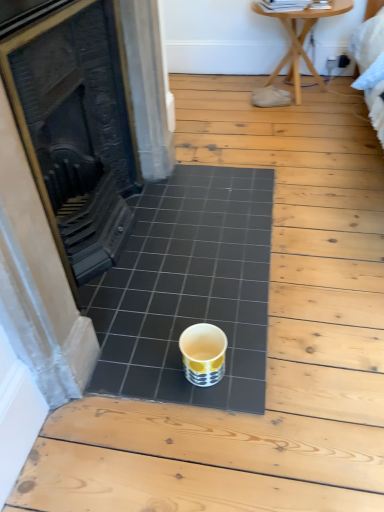
Question: Can you confirm if wooden table at upper right is wider than black ceramic tile at center?

Choices:
 (A) no
 (B) yes

Answer: (A)

Question: Is wooden table at upper right turned away from black ceramic tile at center?

Choices:
 (A) no
 (B) yes

Answer: (A)

Question: From the image's perspective, is wooden table at upper right on black ceramic tile at center?

Choices:
 (A) no
 (B) yes

Answer: (B)

Question: Are wooden table at upper right and black ceramic tile at center far apart?

Choices:
 (A) no
 (B) yes

Answer: (B)

Question: Is wooden table at upper right directly adjacent to black ceramic tile at center?

Choices:
 (A) yes
 (B) no

Answer: (B)

Question: From the image's perspective, is yellow and white ceramic cup at center located above or below wooden table at upper right?

Choices:
 (A) below
 (B) above

Answer: (A)

Question: In terms of size, does yellow and white ceramic cup at center appear bigger or smaller than wooden table at upper right?

Choices:
 (A) small
 (B) big

Answer: (A)

Question: Considering the positions of yellow and white ceramic cup at center and wooden table at upper right in the image, is yellow and white ceramic cup at center wider or thinner than wooden table at upper right?

Choices:
 (A) wide
 (B) thin

Answer: (B)

Question: Is yellow and white ceramic cup at center to the left or to the right of wooden table at upper right in the image?

Choices:
 (A) left
 (B) right

Answer: (A)

Question: Considering the positions of point (326, 15) and point (190, 190), is point (326, 15) closer or farther from the camera than point (190, 190)?

Choices:
 (A) closer
 (B) farther

Answer: (B)

Question: Relative to black ceramic tile at center, is wooden table at upper right in front or behind?

Choices:
 (A) behind
 (B) front

Answer: (A)

Question: Is wooden table at upper right taller or shorter than black ceramic tile at center?

Choices:
 (A) short
 (B) tall

Answer: (B)

Question: Is wooden table at upper right bigger or smaller than black ceramic tile at center?

Choices:
 (A) small
 (B) big

Answer: (B)

Question: Based on their sizes in the image, would you say black cast iron fireplace at center is bigger or smaller than black ceramic tile at center?

Choices:
 (A) small
 (B) big

Answer: (B)

Question: Is black cast iron fireplace at center spatially inside black ceramic tile at center, or outside of it?

Choices:
 (A) inside
 (B) outside

Answer: (B)